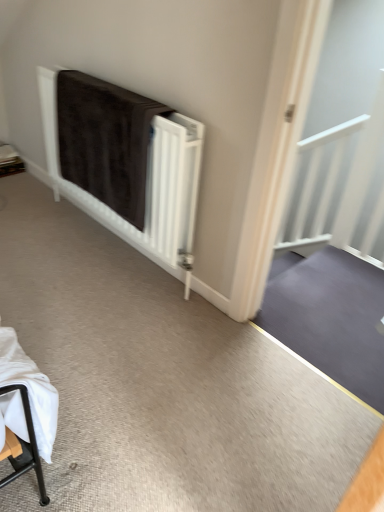
Identify the location of brown fabric at center. The width and height of the screenshot is (384, 512). (146, 179).

Image resolution: width=384 pixels, height=512 pixels. What do you see at coordinates (146, 179) in the screenshot? I see `brown fabric at center` at bounding box center [146, 179].

What is the approximate height of brown fabric at center?

It is 31.75 inches.

This screenshot has width=384, height=512. Find the location of `brown fabric at center`. brown fabric at center is located at coordinates (146, 179).